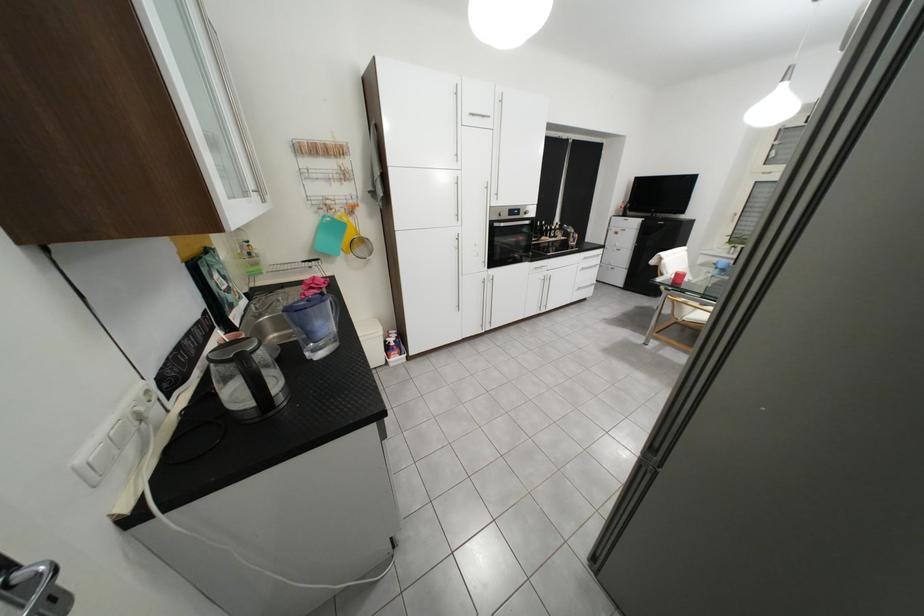
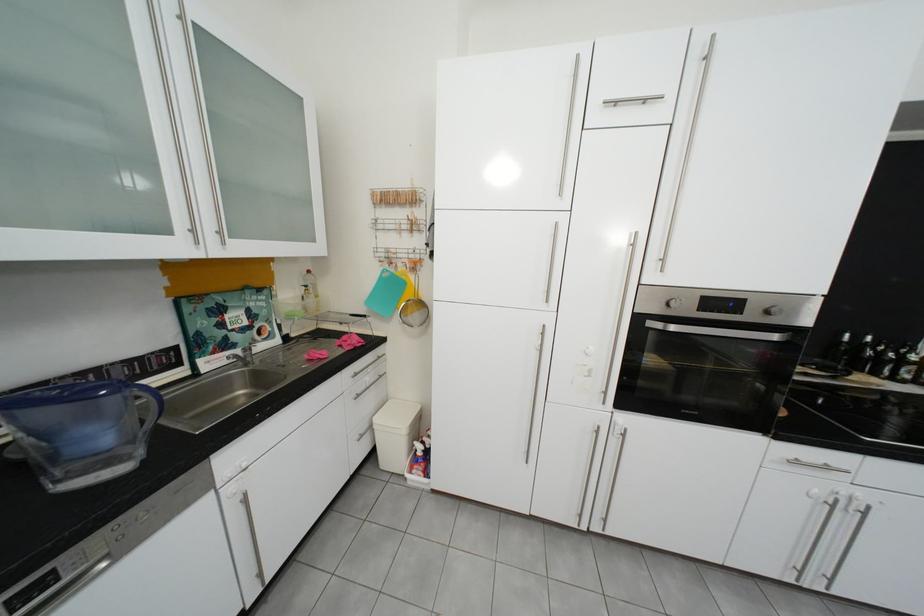
The point at [504,224] is marked in the first image. Where is the corresponding point in the second image?

(650, 320)